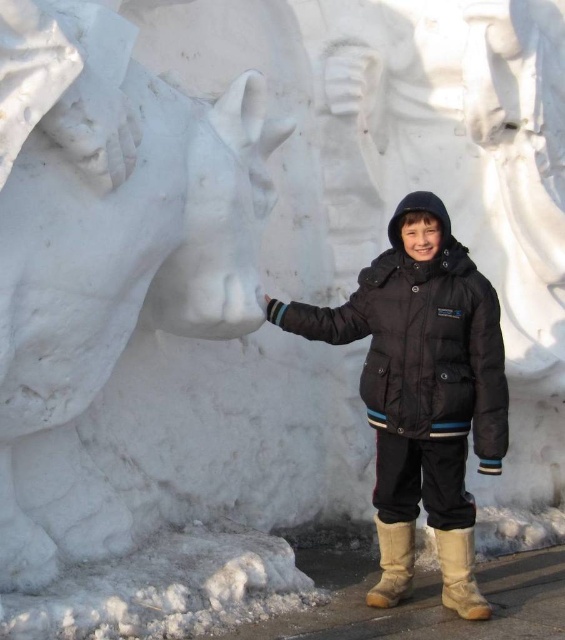
You are a photographer trying to capture the boy and the snow sculpture. To ensure both are in frame, you need to position yourself so that the leather at lower right and the brown suede boot at lower center are aligned horizontally. Which object should you move closer to the center to achieve this alignment?

The leather at lower right is to the right of the brown suede boot at lower center. To align them horizontally, move the leather at lower right closer to the center so it is positioned next to the brown suede boot at lower center.

Consider the image. You are a fashion designer analyzing the image. You need to determine which item of clothing has a greater horizontal measurement between the black matte jacket at center and the brown suede boot at lower center. Based on the scene, which one is wider?

The black matte jacket at center is wider than the brown suede boot at lower center because its width surpasses the boot.

You are standing at the point labeled as point (459, 573). Looking around, you see a young boy in a dark puffer jacket and a snow sculpture of a horse. Which direction should you walk to reach the leather at lower right?

The point (459, 573) is already located on the leather at lower right, so you are already at the destination.